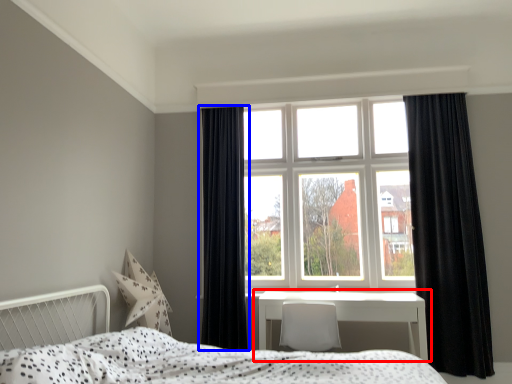
Question: Which point is closer to the camera, table (highlighted by a red box) or curtain (highlighted by a blue box)?

Choices:
 (A) table
 (B) curtain

Answer: (A)